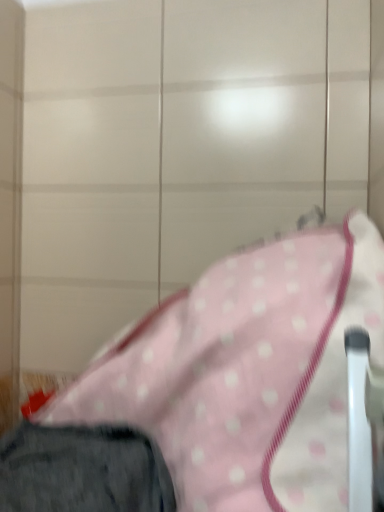
Find the location of a particular element. The image size is (384, 512). pink polka dot fabric at center is located at coordinates (247, 373).

Image resolution: width=384 pixels, height=512 pixels. Describe the element at coordinates (247, 373) in the screenshot. I see `pink polka dot fabric at center` at that location.

The height and width of the screenshot is (512, 384). Find the location of `dark gray fabric trousers at lower left`. dark gray fabric trousers at lower left is located at coordinates (82, 470).

What is the approximate height of dark gray fabric trousers at lower left?

It is 10.48 inches.

This screenshot has height=512, width=384. What do you see at coordinates (82, 470) in the screenshot?
I see `dark gray fabric trousers at lower left` at bounding box center [82, 470].

Where is `pink polka dot fabric at center`? The width and height of the screenshot is (384, 512). pink polka dot fabric at center is located at coordinates (247, 373).

Can you confirm if dark gray fabric trousers at lower left is positioned to the right of pink polka dot fabric at center?

No, dark gray fabric trousers at lower left is not to the right of pink polka dot fabric at center.

Considering their positions, is dark gray fabric trousers at lower left located in front of or behind pink polka dot fabric at center?

In the image, dark gray fabric trousers at lower left appears in front of pink polka dot fabric at center.

Is point (134, 476) closer or farther from the camera than point (248, 398)?

Point (134, 476) is farther from the camera than point (248, 398).

From the image's perspective, who appears lower, dark gray fabric trousers at lower left or pink polka dot fabric at center?

dark gray fabric trousers at lower left is shown below in the image.

From a real-world perspective, relative to pink polka dot fabric at center, is dark gray fabric trousers at lower left vertically above or below?

Clearly, from a real-world perspective, dark gray fabric trousers at lower left is below pink polka dot fabric at center.

Between dark gray fabric trousers at lower left and pink polka dot fabric at center, which one has larger width?

With larger width is pink polka dot fabric at center.

Can you confirm if dark gray fabric trousers at lower left is taller than pink polka dot fabric at center?

Incorrect, the height of dark gray fabric trousers at lower left is not larger of that of pink polka dot fabric at center.

Which of these two, dark gray fabric trousers at lower left or pink polka dot fabric at center, is bigger?

pink polka dot fabric at center.

Is pink polka dot fabric at center surrounded by dark gray fabric trousers at lower left?

That's incorrect, pink polka dot fabric at center is not inside dark gray fabric trousers at lower left.

In the scene shown: Is dark gray fabric trousers at lower left far away from pink polka dot fabric at center?

dark gray fabric trousers at lower left is near pink polka dot fabric at center, not far away.

Is pink polka dot fabric at center at the back of dark gray fabric trousers at lower left?

Yes.

Where is `blanket above the dark gray fabric trousers at lower left (from a real-world perspective)`? This screenshot has height=512, width=384. blanket above the dark gray fabric trousers at lower left (from a real-world perspective) is located at coordinates (247, 373).

Would you say pink polka dot fabric at center is to the left or to the right of dark gray fabric trousers at lower left in the picture?

In the image, pink polka dot fabric at center appears on the right side of dark gray fabric trousers at lower left.

Relative to dark gray fabric trousers at lower left, is pink polka dot fabric at center in front or behind?

Clearly, pink polka dot fabric at center is behind dark gray fabric trousers at lower left.

Considering the positions of point (340, 322) and point (63, 434), is point (340, 322) closer or farther from the camera than point (63, 434)?

Point (340, 322) is closer to the camera than point (63, 434).

From the image's perspective, is pink polka dot fabric at center above or below dark gray fabric trousers at lower left?

Based on their image positions, pink polka dot fabric at center is located above dark gray fabric trousers at lower left.

From a real-world perspective, is pink polka dot fabric at center located higher than dark gray fabric trousers at lower left?

Yes, from a real-world perspective, pink polka dot fabric at center is on top of dark gray fabric trousers at lower left.

From the picture: Is pink polka dot fabric at center wider or thinner than dark gray fabric trousers at lower left?

Considering their sizes, pink polka dot fabric at center looks broader than dark gray fabric trousers at lower left.

Considering the sizes of objects pink polka dot fabric at center and dark gray fabric trousers at lower left in the image provided, who is taller, pink polka dot fabric at center or dark gray fabric trousers at lower left?

pink polka dot fabric at center is taller.

Considering the sizes of objects pink polka dot fabric at center and dark gray fabric trousers at lower left in the image provided, who is smaller, pink polka dot fabric at center or dark gray fabric trousers at lower left?

dark gray fabric trousers at lower left.

Does pink polka dot fabric at center contain dark gray fabric trousers at lower left?

Yes, dark gray fabric trousers at lower left can be found within pink polka dot fabric at center.

Is there a large distance between pink polka dot fabric at center and dark gray fabric trousers at lower left?

That's not correct — pink polka dot fabric at center is a little close to dark gray fabric trousers at lower left.

Could you tell me if pink polka dot fabric at center is facing dark gray fabric trousers at lower left?

Yes, pink polka dot fabric at center is oriented towards dark gray fabric trousers at lower left.

Can you tell me how much pink polka dot fabric at center and dark gray fabric trousers at lower left differ in facing direction?

pink polka dot fabric at center and dark gray fabric trousers at lower left are facing 8.71e-06 degrees away from each other.

How distant is pink polka dot fabric at center from dark gray fabric trousers at lower left?

pink polka dot fabric at center and dark gray fabric trousers at lower left are 18.33 centimeters apart from each other.

In order to click on trousers on the left of pink polka dot fabric at center in this screenshot , I will do `click(82, 470)`.

This screenshot has width=384, height=512. I want to click on trousers lying in front of the pink polka dot fabric at center, so click(82, 470).

At what (x,y) coordinates should I click in order to perform the action: click on trousers on the left of pink polka dot fabric at center. Please return your answer as a coordinate pair (x, y). The height and width of the screenshot is (512, 384). Looking at the image, I should click on (82, 470).